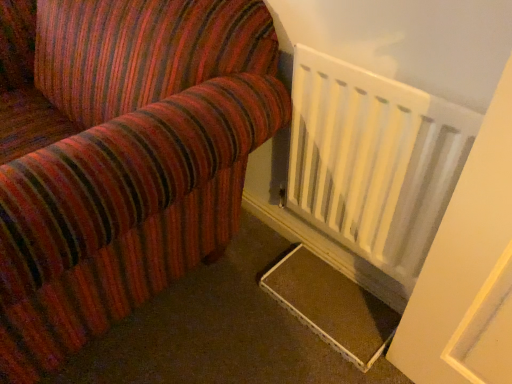
What do you see at coordinates (373, 160) in the screenshot? I see `white matte radiator at lower right` at bounding box center [373, 160].

Image resolution: width=512 pixels, height=384 pixels. What are the coordinates of `white matte radiator at lower right` in the screenshot? It's located at (x=373, y=160).

Locate an element on the screen. Image resolution: width=512 pixels, height=384 pixels. brown textured mat at lower right is located at coordinates (331, 306).

The width and height of the screenshot is (512, 384). Describe the element at coordinates (331, 306) in the screenshot. I see `brown textured mat at lower right` at that location.

Identify the location of white matte radiator at lower right. (373, 160).

Considering the positions of objects brown textured mat at lower right and white matte radiator at lower right in the image provided, who is more to the left, brown textured mat at lower right or white matte radiator at lower right?

From the viewer's perspective, brown textured mat at lower right appears more on the left side.

Is brown textured mat at lower right positioned behind white matte radiator at lower right?

Yes, brown textured mat at lower right is further from the viewer.

Which is behind, point (367, 364) or point (432, 115)?

Positioned behind is point (367, 364).

From the image's perspective, is brown textured mat at lower right on white matte radiator at lower right?

No, from the image's perspective, brown textured mat at lower right is not on top of white matte radiator at lower right.

From a real-world perspective, is brown textured mat at lower right on white matte radiator at lower right?

No, from a real-world perspective, brown textured mat at lower right is not on top of white matte radiator at lower right.

From the picture: Does brown textured mat at lower right have a greater width compared to white matte radiator at lower right?

Yes, brown textured mat at lower right is wider than white matte radiator at lower right.

Considering the sizes of objects brown textured mat at lower right and white matte radiator at lower right in the image provided, who is shorter, brown textured mat at lower right or white matte radiator at lower right?

brown textured mat at lower right.

Can you confirm if brown textured mat at lower right is bigger than white matte radiator at lower right?

No.

Is brown textured mat at lower right located outside white matte radiator at lower right?

Yes, brown textured mat at lower right is outside of white matte radiator at lower right.

Is brown textured mat at lower right far from white matte radiator at lower right?

brown textured mat at lower right is near white matte radiator at lower right, not far away.

Is brown textured mat at lower right facing towards white matte radiator at lower right?

No, brown textured mat at lower right is not oriented towards white matte radiator at lower right.

Where is `radiator located above the brown textured mat at lower right (from a real-world perspective)`? radiator located above the brown textured mat at lower right (from a real-world perspective) is located at coordinates 373,160.

Between white matte radiator at lower right and brown textured mat at lower right, which one appears on the left side from the viewer's perspective?

From the viewer's perspective, brown textured mat at lower right appears more on the left side.

Does white matte radiator at lower right lie behind brown textured mat at lower right?

No, white matte radiator at lower right is in front of brown textured mat at lower right.

Considering the positions of points (385, 257) and (359, 298), is point (385, 257) closer to camera compared to point (359, 298)?

Yes, it is.

From the image's perspective, which one is positioned lower, white matte radiator at lower right or brown textured mat at lower right?

brown textured mat at lower right is shown below in the image.

From a real-world perspective, which object stands above the other?

white matte radiator at lower right, from a real-world perspective.

Is white matte radiator at lower right wider or thinner than brown textured mat at lower right?

Clearly, white matte radiator at lower right has less width compared to brown textured mat at lower right.

Considering the sizes of white matte radiator at lower right and brown textured mat at lower right in the image, is white matte radiator at lower right taller or shorter than brown textured mat at lower right?

In the image, white matte radiator at lower right appears to be taller than brown textured mat at lower right.

Is white matte radiator at lower right bigger or smaller than brown textured mat at lower right?

Considering their sizes, white matte radiator at lower right takes up more space than brown textured mat at lower right.

Is white matte radiator at lower right spatially inside brown textured mat at lower right, or outside of it?

white matte radiator at lower right is located beyond the bounds of brown textured mat at lower right.

Is white matte radiator at lower right next to brown textured mat at lower right?

No, white matte radiator at lower right is not next to brown textured mat at lower right.

Is white matte radiator at lower right positioned with its back to brown textured mat at lower right?

No, white matte radiator at lower right is not facing away from brown textured mat at lower right.

How distant is white matte radiator at lower right from brown textured mat at lower right?

The distance of white matte radiator at lower right from brown textured mat at lower right is 14.45 inches.

Find the location of a particular element. radiator on the right of the brown textured mat at lower right is located at coordinates (373, 160).

Find the location of a particular element. stairs lying on the left of white matte radiator at lower right is located at coordinates (331, 306).

This screenshot has height=384, width=512. In order to click on radiator above the brown textured mat at lower right (from a real-world perspective) in this screenshot , I will do `click(373, 160)`.